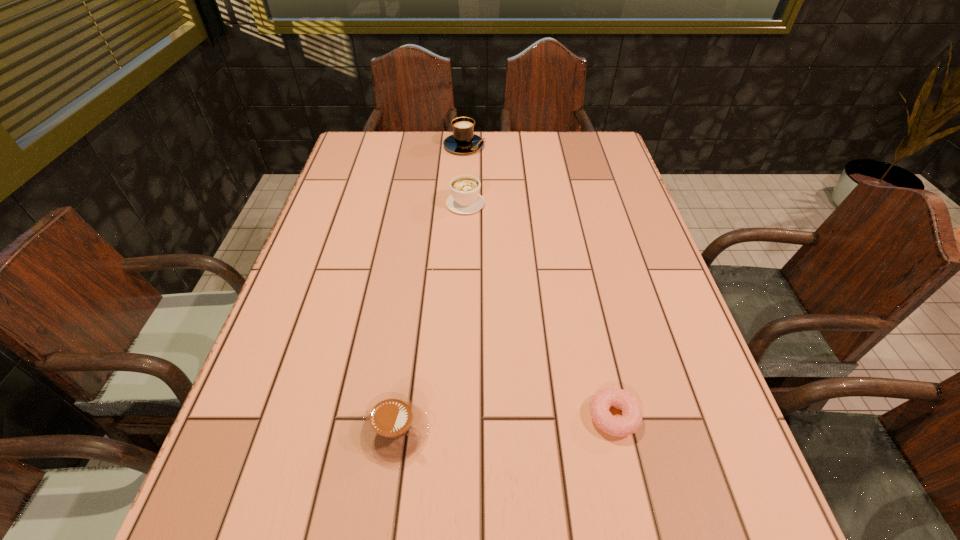
Locate an element on the screen. Image resolution: width=960 pixels, height=540 pixels. the tallest cappuccino is located at coordinates (463, 140).

Find the location of a particular element. the farthest cappuccino is located at coordinates (463, 140).

Locate an element on the screen. the second farthest object is located at coordinates (465, 199).

You are a GUI agent. You are given a task and a screenshot of the screen. Output one action in this format:
    pyautogui.click(x=<x>, y=<y>)
    Task: Click on the nearest cappuccino
    
    Given the screenshot: What is the action you would take?
    pyautogui.click(x=394, y=427)

Identify the location of doughnut. This screenshot has width=960, height=540. (630, 421).

You are a GUI agent. You are given a task and a screenshot of the screen. Output one action in this format:
    pyautogui.click(x=<x>, y=<y>)
    Task: Click on the rightmost object
    
    Given the screenshot: What is the action you would take?
    pyautogui.click(x=630, y=421)

This screenshot has height=540, width=960. In order to click on vacant space positioned 0.170m on the left of the farthest object in this screenshot , I will do `click(392, 146)`.

At what (x,y) coordinates should I click in order to perform the action: click on vacant point located 0.120m to the right of the second farthest cappuccino's handle. Please return your answer as a coordinate pair (x, y). Looking at the image, I should click on (467, 168).

Where is `vacant space situated 0.180m to the right of the second farthest cappuccino's handle`? vacant space situated 0.180m to the right of the second farthest cappuccino's handle is located at coordinates (468, 158).

This screenshot has width=960, height=540. What are the coordinates of `blank space located 0.270m to the right of the second farthest cappuccino's handle` in the screenshot? It's located at (468, 144).